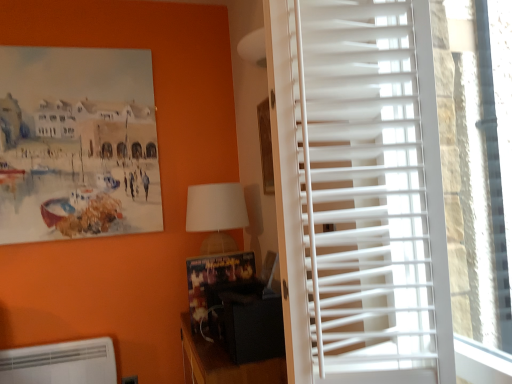
Question: Is point (104, 347) positioned closer to the camera than point (384, 284)?

Choices:
 (A) farther
 (B) closer

Answer: (A)

Question: Would you say white plastic air conditioning unit at lower left is inside or outside white plastic blinds at right?

Choices:
 (A) inside
 (B) outside

Answer: (B)

Question: Which of these objects is positioned closest to the white fabric lampshade at center?

Choices:
 (A) white plastic air conditioning unit at lower left
 (B) white plastic blinds at right
 (C) wooden picture frame at upper center
 (D) black matte speaker at lower center
 (E) white plastic blinds at right

Answer: (C)

Question: Considering the real-world distances, which object is farthest from the white plastic air conditioning unit at lower left?

Choices:
 (A) white fabric lampshade at center
 (B) white plastic blinds at right
 (C) wooden bulletin board at center
 (D) black matte speaker at lower center
 (E) white plastic blinds at right

Answer: (B)